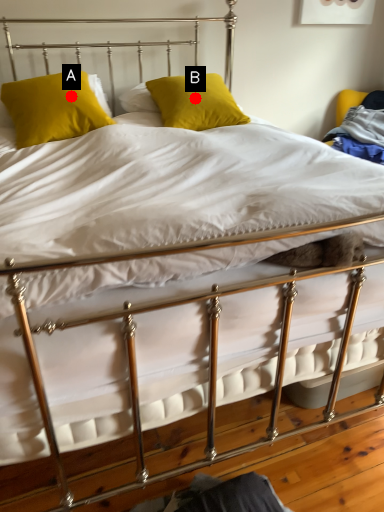
Question: Two points are circled on the image, labeled by A and B beside each circle. Which point appears farthest from the camera in this image?

Choices:
 (A) A is further
 (B) B is further

Answer: (B)